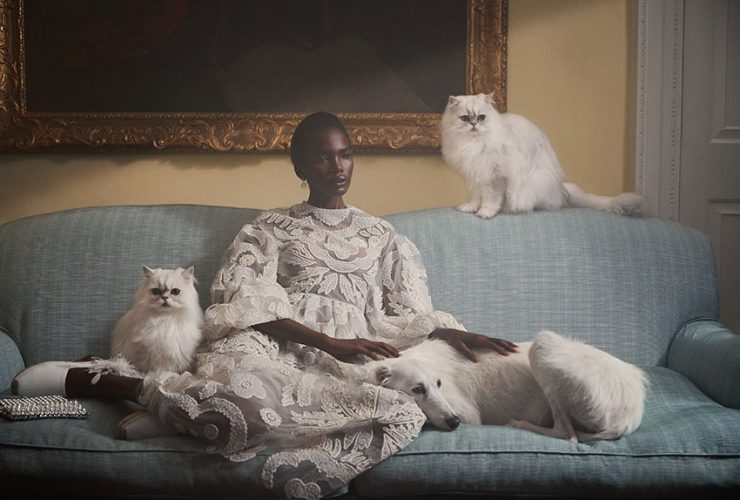
Find the location of a particular element. The height and width of the screenshot is (500, 740). gold frame is located at coordinates (192, 134).